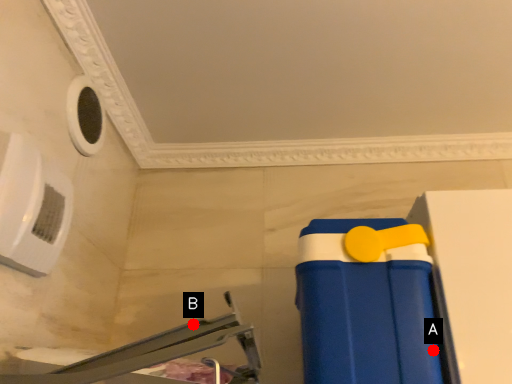
Question: Two points are circled on the image, labeled by A and B beside each circle. Which point is farther from the camera taking this photo?

Choices:
 (A) A is further
 (B) B is further

Answer: (A)